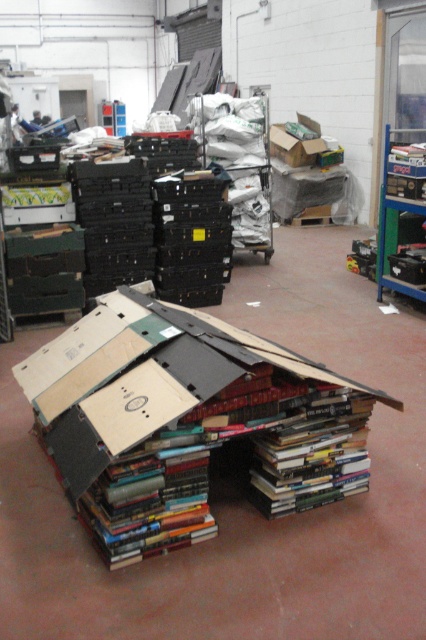
You are a delivery person who just arrived at the warehouse. You need to place a new metallic blue bookshelf at upper right. The warehouse manager says there is a spot marked by point (394, 225). Is that the correct location for the bookshelf?

Yes, the metallic blue bookshelf at upper right is represented by point (394, 225), so the spot marked by that point is the correct location for the bookshelf.

You are an employee in the warehouse and need to move the metallic blue bookshelf at upper right and the cardboard box at upper center to a new location. Which object will require more space when moving horizontally?

The cardboard box at upper center requires more horizontal space because it is thicker than the metallic blue bookshelf at upper right.

You are a warehouse worker who needs to place a new item on the highest point available. Which object should you choose between the metallic blue bookshelf at upper right and the cardboard box at upper center?

The metallic blue bookshelf at upper right has a greater height compared to the cardboard box at upper center, so you should choose the metallic blue bookshelf at upper right as the highest point available.